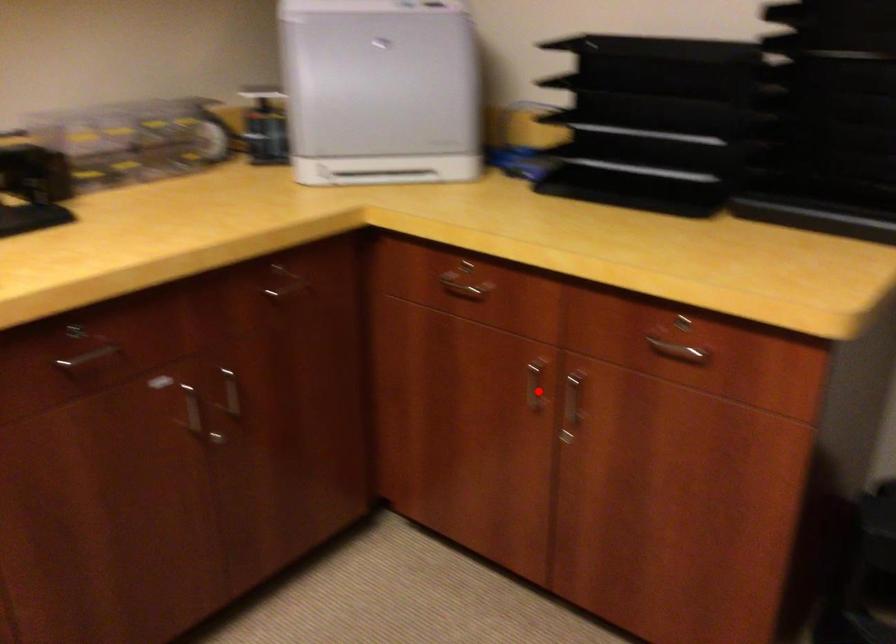
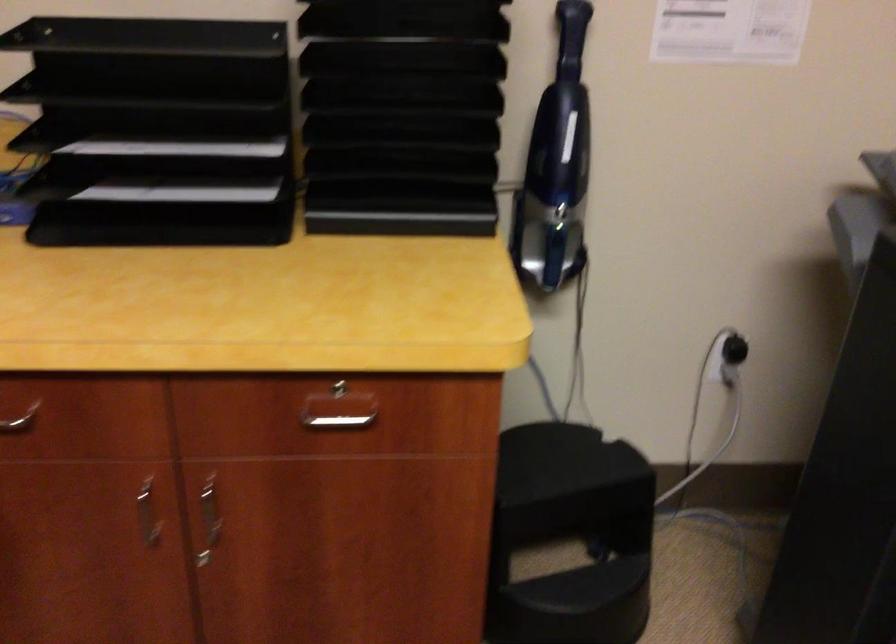
Find the pixel in the second image that matches the highlighted location in the first image.

(148, 514)